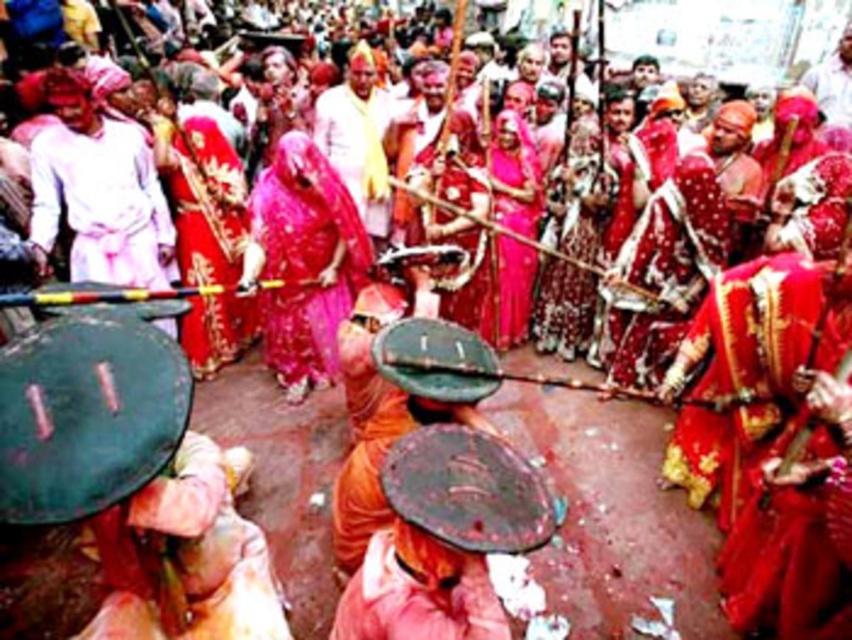
Which of these two, white matte robe at left or matte yellow cloth at center, stands taller?

matte yellow cloth at center is taller.

Is point (162, 225) behind point (392, 102)?

No, it is in front of (392, 102).

Is point (96, 257) less distant than point (355, 184)?

Yes.

I want to click on white matte robe at left, so click(x=101, y=204).

Is matte red robe at center above matte yellow cloth at center?

Actually, matte red robe at center is below matte yellow cloth at center.

Is matte red robe at center to the left of matte yellow cloth at center from the viewer's perspective?

Indeed, matte red robe at center is positioned on the left side of matte yellow cloth at center.

Does point (213, 278) come behind point (384, 208)?

No, (213, 278) is closer to viewer.

This screenshot has width=852, height=640. What are the coordinates of `matte red robe at center` in the screenshot? It's located at (205, 202).

Between matte pink sari at center and white matte robe at left, which one is positioned lower?

matte pink sari at center

Does point (296, 230) lie in front of point (82, 250)?

Yes, point (296, 230) is in front of point (82, 250).

The image size is (852, 640). I want to click on matte pink sari at center, so click(304, 259).